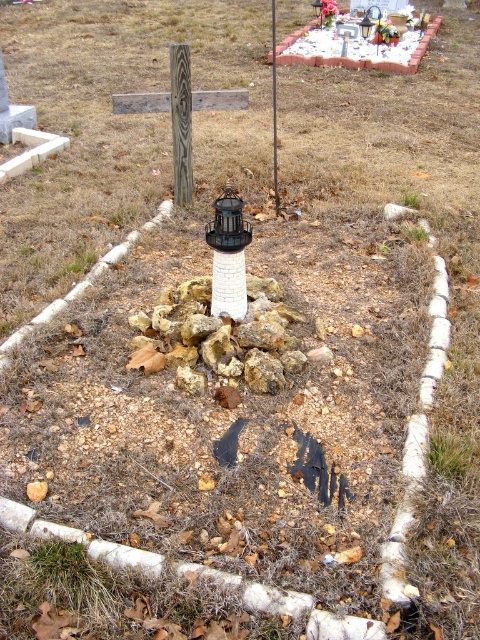
Who is positioned more to the left, green grass at center or brushed wood post at center?

Positioned to the left is brushed wood post at center.

Is green grass at center wider than brushed wood post at center?

No.

The image size is (480, 640). What do you see at coordinates (450, 454) in the screenshot?
I see `green grass at center` at bounding box center [450, 454].

What are the coordinates of `green grass at center` in the screenshot? It's located at (x=450, y=454).

Between weathered wood post at center and brushed wood post at center, which one has more height?

brushed wood post at center

Does weathered wood post at center appear on the right side of brushed wood post at center?

In fact, weathered wood post at center is to the left of brushed wood post at center.

Who is more forward, (183,99) or (275,40)?

Positioned in front is point (183,99).

The image size is (480, 640). I want to click on weathered wood post at center, so click(180, 122).

Which of these two, green grass at lower left or weathered wood post at center, stands taller?

weathered wood post at center

Which is in front, point (25, 621) or point (177, 120)?

Point (25, 621)

This screenshot has height=640, width=480. In order to click on green grass at lower left in this screenshot , I will do 60,589.